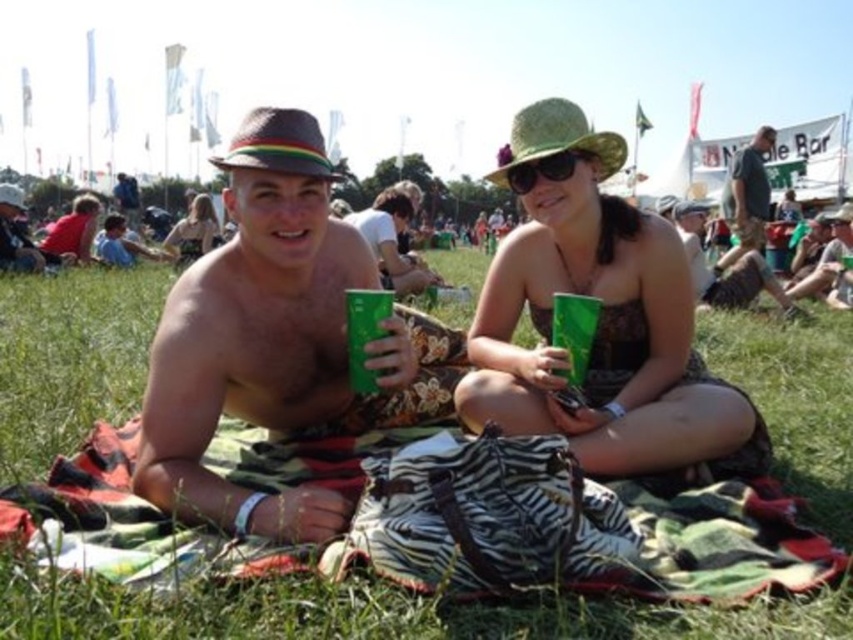
You are at a festival and see two people wearing the green fabric dress at center and the red matte shirt at left. Which one is positioned to the right of the other?

The green fabric dress at center is positioned to the right of the red matte shirt at left.

You are planning to set up a small tent in the green grass at center. Considering the space available, will the matte black dress at upper left interfere with the tent setup?

The green grass at center is wider than the matte black dress at upper left, so there should be enough space to set up the tent without interference from the matte black dress at upper left.